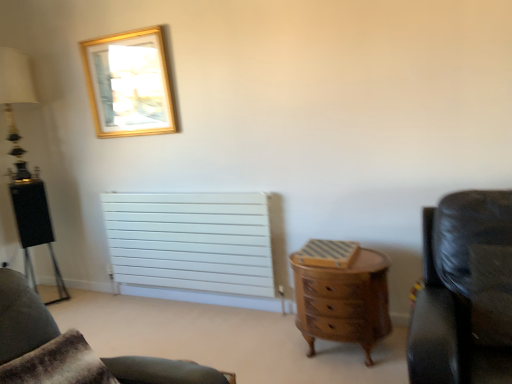
What do you see at coordinates (190, 241) in the screenshot? I see `white matte radiator at center` at bounding box center [190, 241].

In order to face brown fur pillow at lower left, should I rotate leftwards or rightwards?

A 23.207 degree turn to the left will do.

This screenshot has width=512, height=384. Find the location of `brown fur pillow at lower left`. brown fur pillow at lower left is located at coordinates (58, 364).

Measure the distance between gold metallic picture frame at upper left and camera.

The distance of gold metallic picture frame at upper left from camera is 2.95 meters.

Where is `black leather chair at right, the 2th chair positioned from the bottom`? The image size is (512, 384). black leather chair at right, the 2th chair positioned from the bottom is located at coordinates (464, 292).

This screenshot has width=512, height=384. Identify the location of white matte radiator at center. (190, 241).

From a real-world perspective, relative to wooden chest of drawers at center, is gold metallic picture frame at upper left vertically above or below?

In terms of real-world spatial position, gold metallic picture frame at upper left is above wooden chest of drawers at center.

Looking at this image, between gold metallic picture frame at upper left and wooden chest of drawers at center, which one has larger width?

With larger width is wooden chest of drawers at center.

Considering the positions of point (106, 108) and point (366, 270), is point (106, 108) closer or farther from the camera than point (366, 270)?

Clearly, point (106, 108) is more distant from the camera than point (366, 270).

Measure the distance from gold metallic picture frame at upper left to wooden chest of drawers at center.

gold metallic picture frame at upper left is 5.69 feet away from wooden chest of drawers at center.

Does brown fur pillow at lower left have a lesser width compared to wooden chest of drawers at center?

No, brown fur pillow at lower left is not thinner than wooden chest of drawers at center.

Can you confirm if brown fur pillow at lower left is positioned to the left of wooden chest of drawers at center?

Yes.

From a real-world perspective, is brown fur pillow at lower left positioned above or below wooden chest of drawers at center?

brown fur pillow at lower left is above wooden chest of drawers at center.

Considering the positions of objects black leather chair at right, which is counted as the first chair, starting from the top, and brown fur pillow at lower left in the image provided, who is more to the right, black leather chair at right, which is counted as the first chair, starting from the top, or brown fur pillow at lower left?

From the viewer's perspective, black leather chair at right, which is counted as the first chair, starting from the top, appears more on the right side.

From the image's perspective, is black leather chair at right, the 2th chair positioned from the bottom, above or below brown fur pillow at lower left?

From the image's perspective, black leather chair at right, the 2th chair positioned from the bottom, appears above brown fur pillow at lower left.

Is point (459, 348) closer to camera compared to point (52, 380)?

No.

Starting from the brown fur pillow at lower left, which chair is the 1st one behind? Please provide its 2D coordinates.

[(464, 292)]

Image resolution: width=512 pixels, height=384 pixels. Identify the location of pillow that is under the matte black lamp at left (from a real-world perspective). (58, 364).

Based on the photo, does matte black lamp at left turn towards brown fur pillow at lower left?

No, matte black lamp at left is not oriented towards brown fur pillow at lower left.

Which is more to the left, matte black lamp at left or brown fur pillow at lower left?

matte black lamp at left is more to the left.

Is brown fur pillow at lower left completely or partially inside wooden chest of drawers at center?

No, brown fur pillow at lower left is located outside of wooden chest of drawers at center.

Is wooden chest of drawers at center to the left of brown fur pillow at lower left from the viewer's perspective?

In fact, wooden chest of drawers at center is to the right of brown fur pillow at lower left.

Considering the relative sizes of wooden chest of drawers at center and brown fur pillow at lower left in the image provided, is wooden chest of drawers at center taller than brown fur pillow at lower left?

Yes, wooden chest of drawers at center is taller than brown fur pillow at lower left.

Which object is thinner, wooden chest of drawers at center or brown fur pillow at lower left?

With smaller width is wooden chest of drawers at center.

Who is bigger, brown fur pillow at lower left or gold metallic picture frame at upper left?

brown fur pillow at lower left is bigger.

From the image's perspective, between brown fur pillow at lower left and gold metallic picture frame at upper left, which one is located above?

gold metallic picture frame at upper left appears higher in the image.

Between brown fur pillow at lower left and gold metallic picture frame at upper left, which one is positioned behind?

gold metallic picture frame at upper left is behind.

Which of these two, brown fur pillow at lower left or gold metallic picture frame at upper left, is thinner?

With smaller width is gold metallic picture frame at upper left.

Is wooden chest of drawers at center smaller than white matte radiator at center?

Correct, wooden chest of drawers at center occupies less space than white matte radiator at center.

Is wooden chest of drawers at center positioned far away from white matte radiator at center?

They are positioned close to each other.

From a real-world perspective, is wooden chest of drawers at center on top of white matte radiator at center?

No, from a real-world perspective, wooden chest of drawers at center is not on top of white matte radiator at center.

Find the location of a particular element. Image resolution: width=512 pixels, height=384 pixels. chest of drawers on the right of gold metallic picture frame at upper left is located at coordinates (344, 301).

Identify the location of pillow located above the wooden chest of drawers at center (from the image's perspective). (58, 364).

Estimate the real-world distances between objects in this image. Which object is further from white matte radiator at center, brown fur pillow at lower left or matte black lamp at left?

Based on the image, brown fur pillow at lower left appears to be further to white matte radiator at center.

Considering their positions, is white matte radiator at center positioned closer to gold metallic picture frame at upper left than wooden chest of drawers at center?

The object closer to gold metallic picture frame at upper left is white matte radiator at center.

Considering their positions, is brown fur pillow at lower left positioned closer to leather couch at lower right, positioned as the first chair in back-to-front order, than matte black lamp at left?

brown fur pillow at lower left is positioned closer to the anchor leather couch at lower right, positioned as the first chair in back-to-front order.

Considering their positions, is brown fur pillow at lower left positioned further to black leather chair at right, placed as the 2th chair when sorted from back to front, than matte black lamp at left?

matte black lamp at left.

Looking at this image, considering their positions, is gold metallic picture frame at upper left positioned closer to matte black lamp at left than wooden chest of drawers at center?

gold metallic picture frame at upper left is positioned closer to the anchor matte black lamp at left.

Looking at the image, which one is located closer to black leather chair at right, which is counted as the first chair, starting from the top, matte black lamp at left or wooden chest of drawers at center?

The object closer to black leather chair at right, which is counted as the first chair, starting from the top, is wooden chest of drawers at center.

From the picture: Based on their spatial positions, is gold metallic picture frame at upper left or black leather chair at right, the 2th chair positioned from the bottom, further from white matte radiator at center?

→ black leather chair at right, the 2th chair positioned from the bottom, is further to white matte radiator at center.

Consider the image. When comparing their distances from black leather chair at right, which appears as the 1th chair when viewed from the right, does matte black lamp at left or leather couch at lower right, positioned as the first chair in back-to-front order, seem closer?

The object closer to black leather chair at right, which appears as the 1th chair when viewed from the right, is leather couch at lower right, positioned as the first chair in back-to-front order.

The image size is (512, 384). Identify the location of pillow between matte black lamp at left and wooden chest of drawers at center. (58, 364).

Identify the location of chair between gold metallic picture frame at upper left and black leather chair at right, which is counted as the first chair, starting from the top, from left to right. This screenshot has height=384, width=512. (22, 318).

The image size is (512, 384). I want to click on pillow between leather couch at lower right, positioned as the first chair in back-to-front order, and black leather chair at right, placed as the 2th chair when sorted from back to front, from left to right, so 58,364.

Locate an element on the screen. The width and height of the screenshot is (512, 384). radiator between gold metallic picture frame at upper left and wooden chest of drawers at center in the vertical direction is located at coordinates (190, 241).